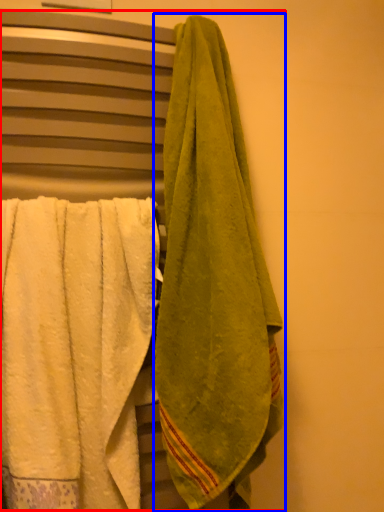
Question: Which object is further to the camera taking this photo, laundry (highlighted by a red box) or towel (highlighted by a blue box)?

Choices:
 (A) laundry
 (B) towel

Answer: (A)